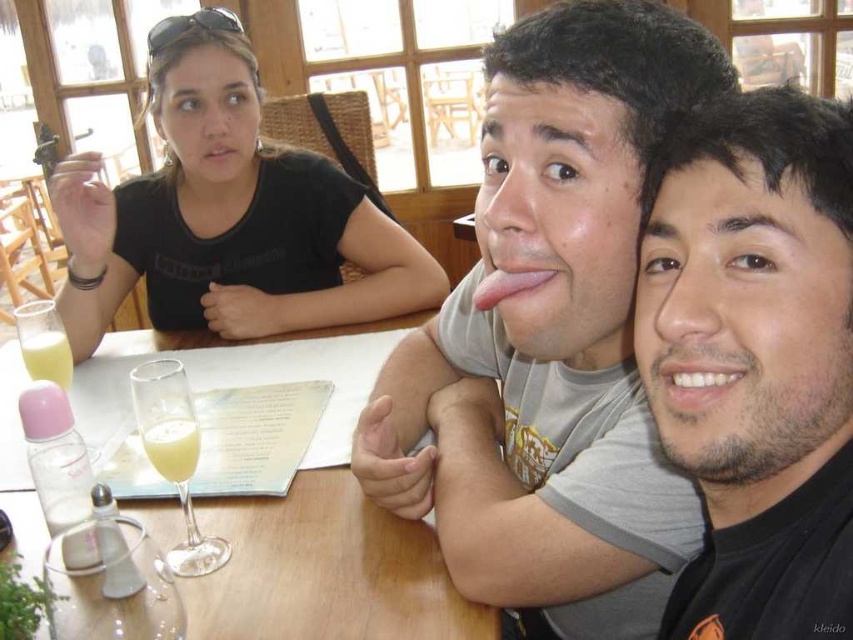
Does point (479, 288) lie in front of point (225, 141)?

Yes.

Who is higher up, pink matte tongue at center or pink matte lips at upper center?

pink matte lips at upper center

Between point (491, 292) and point (247, 152), which one is positioned in front?

Point (491, 292) is more forward.

Find the location of a particular element. pink matte tongue at center is located at coordinates (508, 285).

Is black matte shirt at upper left thinner than translucent plastic cup at table left?

No.

Is black matte shirt at upper left smaller than translucent plastic cup at table left?

Actually, black matte shirt at upper left might be larger than translucent plastic cup at table left.

The height and width of the screenshot is (640, 853). What do you see at coordinates (227, 218) in the screenshot?
I see `black matte shirt at upper left` at bounding box center [227, 218].

Identify the location of black matte shirt at upper left. (227, 218).

Which is in front, point (721, 525) or point (490, 301)?

Point (721, 525)

Does black matte face at center appear on the left side of pink matte tongue at center?

Incorrect, black matte face at center is not on the left side of pink matte tongue at center.

The width and height of the screenshot is (853, 640). Identify the location of black matte face at center. (758, 358).

Locate an element on the screen. The image size is (853, 640). black matte face at center is located at coordinates (758, 358).